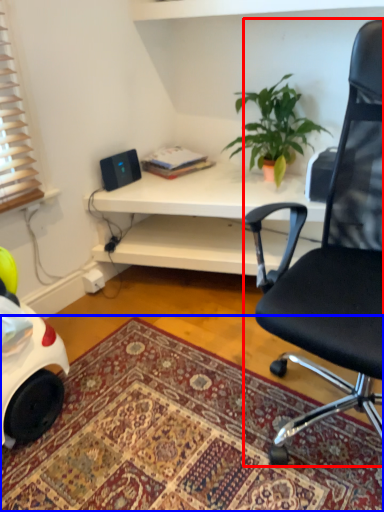
Question: Which point is further to the camera, chair (highlighted by a red box) or mat (highlighted by a blue box)?

Choices:
 (A) chair
 (B) mat

Answer: (B)